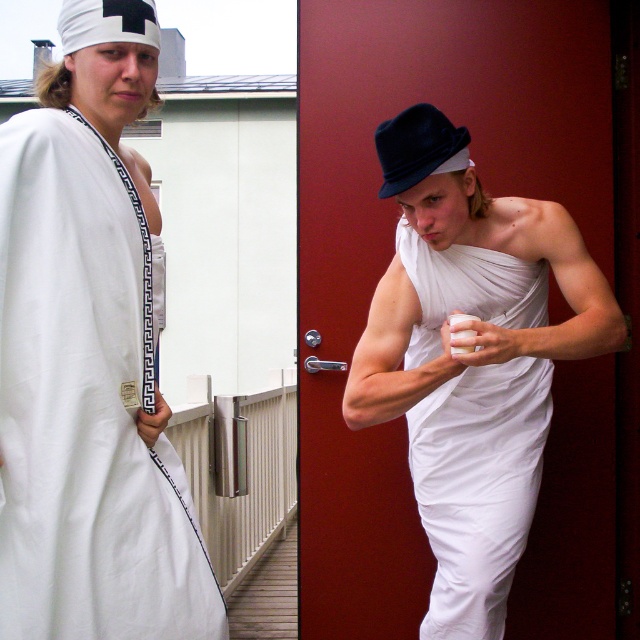
You are standing at the location where the viewer is positioned in the image. There is a white draped cloth at center. If you want to reach it, how many steps would you need to take if each step covers 2.4 feet?

The white draped cloth at center is 7.23 feet away from the viewer. Since each step covers 2.4 feet, dividing 7.23 by 2.4 gives approximately 3 steps. Therefore, you would need to take about 3 steps to reach the white draped cloth at center.